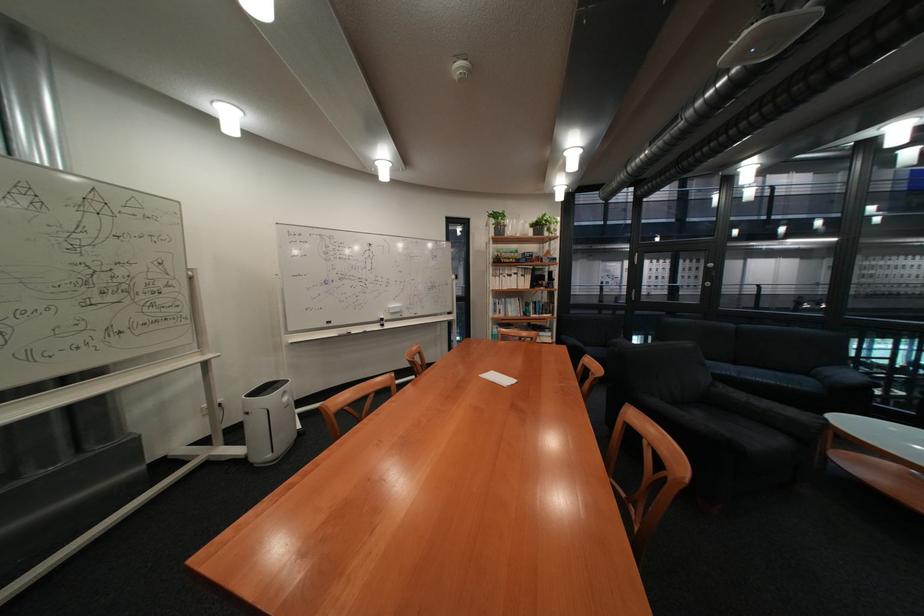
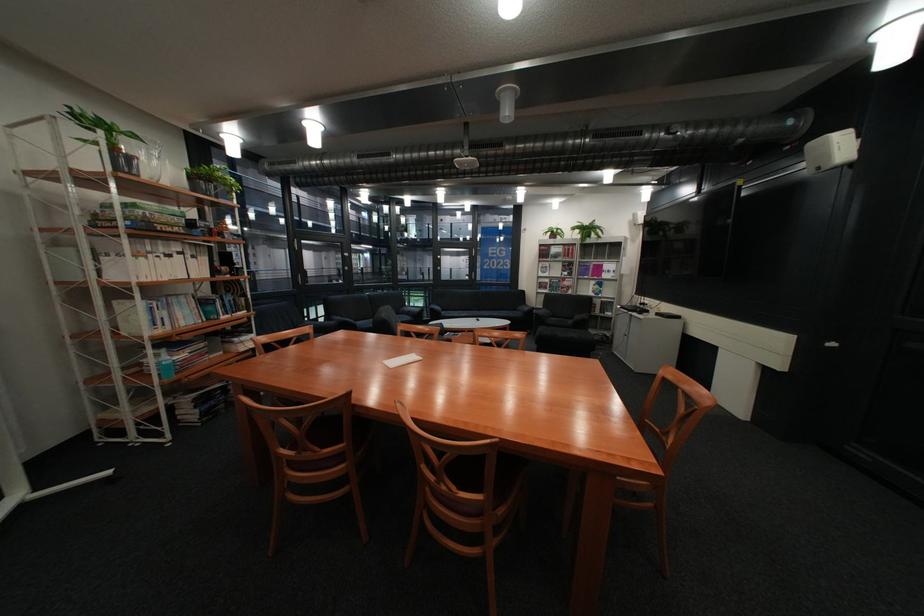
In the second image, find the point that corresponds to [519,235] in the first image.

(152, 177)